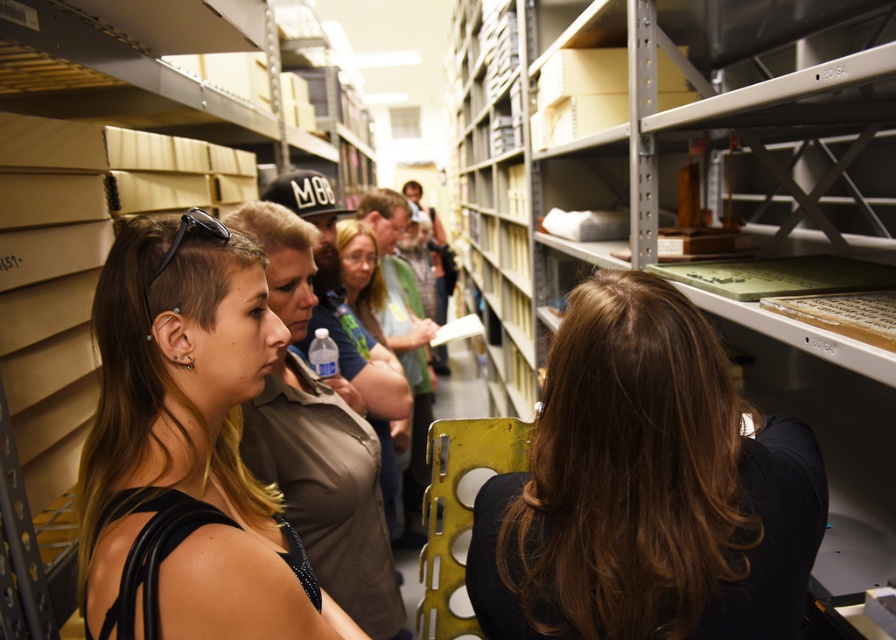
Looking at this image, you are a photographer in the storage room and want to take a portrait of the person at center. Since the lighting is bright, you decide to position the person so that their matte black tank top at center is illuminated while their brown hair at center is in shadow. Is this possible given their current positions?

The brown hair at center is located below matte black tank top at center, so yes, by angling the light upwards, the matte black tank top at center can be lit while the brown hair at center remains in shadow.

You are a photographer trying to capture a clear shot of the brown hair at center and the matte black tank top at center. Given that your camera can only focus on objects larger than 10 cm, will both items be in focus?

The brown hair at center is smaller than the matte black tank top at center. Since the camera requires objects to be larger than 10 cm for focus, only the matte black tank top at center meets the size requirement and will be in focus. The brown hair at center may be too small to focus properly.